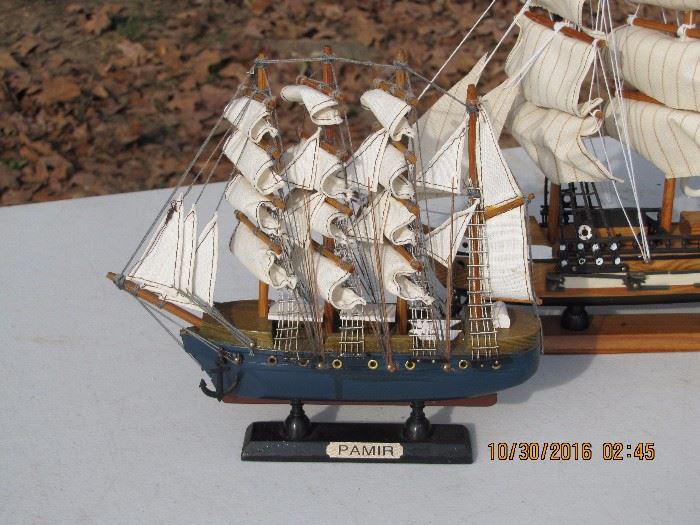
Where is `table`? This screenshot has height=525, width=700. table is located at coordinates (152, 400).